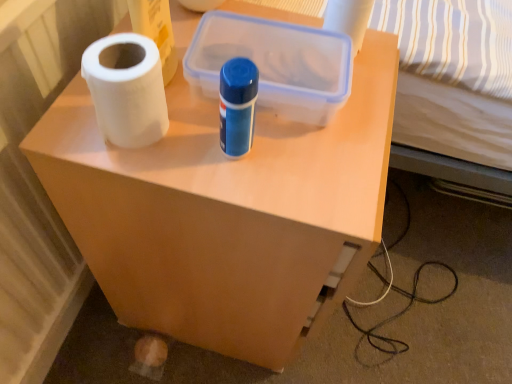
Locate an element on the screen. free spot in front of white matte toilet paper at upper center is located at coordinates (333, 124).